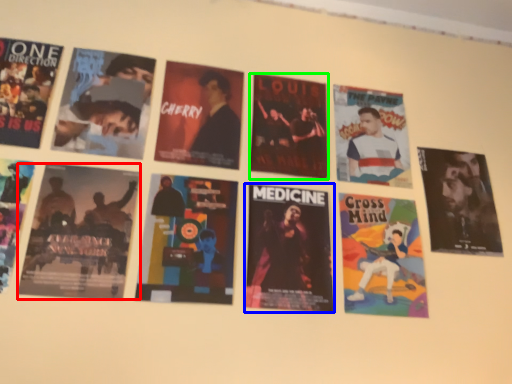
Question: Based on their relative distances, which object is farther from poster (highlighted by a red box)? Choose from poster (highlighted by a blue box) and poster (highlighted by a green box).

Choices:
 (A) poster
 (B) poster

Answer: (B)